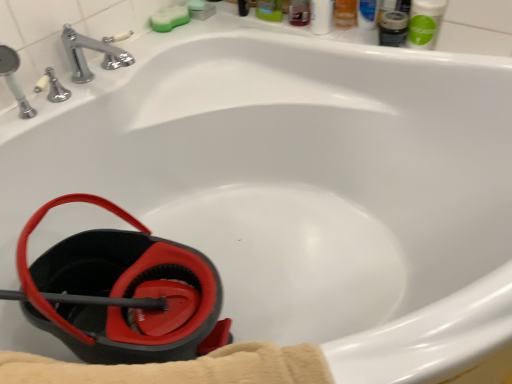
What are the coordinates of `green sponge at upper center` in the screenshot? It's located at (169, 18).

At what (x,y) coordinates should I click in order to perform the action: click on matte black mouthwash at upper right, which appears as the second mouthwash when viewed from the right. Please return your answer as a coordinate pair (x, y). The width and height of the screenshot is (512, 384). Looking at the image, I should click on (393, 28).

Locate an element on the screen. green sponge at upper center is located at coordinates (169, 18).

Are green sponge at upper center and matte black mouthwash at upper right, which appears as the second mouthwash when viewed from the right, located far from each other?

They are positioned close to each other.

Could you tell me if green sponge at upper center is facing matte black mouthwash at upper right, which appears as the second mouthwash when viewed from the right?

Yes, green sponge at upper center is turned towards matte black mouthwash at upper right, which appears as the second mouthwash when viewed from the right.

Does green sponge at upper center have a smaller size compared to matte black mouthwash at upper right, which appears as the second mouthwash when viewed from the right?

Yes, green sponge at upper center is smaller than matte black mouthwash at upper right, which appears as the second mouthwash when viewed from the right.

Consider the image. Considering the relative positions of green sponge at upper center and matte black mouthwash at upper right, which appears as the second mouthwash when viewed from the right, in the image provided, is green sponge at upper center to the right of matte black mouthwash at upper right, which appears as the second mouthwash when viewed from the right, from the viewer's perspective?

Incorrect, green sponge at upper center is not on the right side of matte black mouthwash at upper right, which appears as the second mouthwash when viewed from the right.

Where is `the 2nd mouthwash above the black rubber bucket at lower left (from the image's perspective)`? This screenshot has width=512, height=384. the 2nd mouthwash above the black rubber bucket at lower left (from the image's perspective) is located at coordinates pyautogui.click(x=425, y=23).

In terms of width, does green matte mouthwash at upper right, the first mouthwash positioned from the right, look wider or thinner when compared to black rubber bucket at lower left?

In the image, green matte mouthwash at upper right, the first mouthwash positioned from the right, appears to be more narrow than black rubber bucket at lower left.

Could you measure the distance between green matte mouthwash at upper right, the first mouthwash positioned from the right, and black rubber bucket at lower left?

1.10 meters.

Can you confirm if green matte mouthwash at upper right, the first mouthwash positioned from the right, is shorter than black rubber bucket at lower left?

Correct, green matte mouthwash at upper right, the first mouthwash positioned from the right, is not as tall as black rubber bucket at lower left.

Does green sponge at upper center have a lesser height compared to black rubber bucket at lower left?

Yes.

Does point (170, 11) appear closer or farther from the camera than point (177, 349)?

Clearly, point (170, 11) is more distant from the camera than point (177, 349).

Is green sponge at upper center smaller than black rubber bucket at lower left?

Yes, green sponge at upper center is smaller than black rubber bucket at lower left.

Locate an element on the screen. job in front of the green sponge at upper center is located at coordinates (122, 293).

Which is behind, matte black mouthwash at upper right, which appears as the second mouthwash when viewed from the right, or black rubber bucket at lower left?

matte black mouthwash at upper right, which appears as the second mouthwash when viewed from the right, is more distant.

Which object is positioned more to the left, matte black mouthwash at upper right, which appears as the second mouthwash when viewed from the right, or black rubber bucket at lower left?

black rubber bucket at lower left.

From the image's perspective, between matte black mouthwash at upper right, which appears as the second mouthwash when viewed from the right, and black rubber bucket at lower left, who is located below?

black rubber bucket at lower left appears lower in the image.

Is matte black mouthwash at upper right, which appears as the second mouthwash when viewed from the right, facing towards black rubber bucket at lower left?

Yes, matte black mouthwash at upper right, which appears as the second mouthwash when viewed from the right, faces towards black rubber bucket at lower left.

Considering the sizes of objects green matte mouthwash at upper right, which is the 2th mouthwash in left-to-right order, and matte black mouthwash at upper right, which appears as the first mouthwash when viewed from the left, in the image provided, who is thinner, green matte mouthwash at upper right, which is the 2th mouthwash in left-to-right order, or matte black mouthwash at upper right, which appears as the first mouthwash when viewed from the left,?

With smaller width is matte black mouthwash at upper right, which appears as the first mouthwash when viewed from the left.

From a real-world perspective, who is located lower, green matte mouthwash at upper right, the first mouthwash positioned from the right, or matte black mouthwash at upper right, which appears as the second mouthwash when viewed from the right?

matte black mouthwash at upper right, which appears as the second mouthwash when viewed from the right.

Is green matte mouthwash at upper right, which is the 2th mouthwash in left-to-right order, oriented away from matte black mouthwash at upper right, which appears as the first mouthwash when viewed from the left?

green matte mouthwash at upper right, which is the 2th mouthwash in left-to-right order, is not turned away from matte black mouthwash at upper right, which appears as the first mouthwash when viewed from the left.

Is green matte mouthwash at upper right, the first mouthwash positioned from the right, next to matte black mouthwash at upper right, which appears as the first mouthwash when viewed from the left?

Yes, green matte mouthwash at upper right, the first mouthwash positioned from the right, is right next to matte black mouthwash at upper right, which appears as the first mouthwash when viewed from the left, and making contact.

Is green sponge at upper center inside black rubber bucket at lower left?

No, green sponge at upper center is not a part of black rubber bucket at lower left.

Between point (218, 325) and point (186, 12), which one is positioned in front?

The point (218, 325) is closer to the camera.

Which object is further away from the camera, black rubber bucket at lower left or green sponge at upper center?

green sponge at upper center.

How different are the orientations of green sponge at upper center and green matte mouthwash at upper right, which is the 2th mouthwash in left-to-right order, in degrees?

The angle between the facing direction of green sponge at upper center and the facing direction of green matte mouthwash at upper right, which is the 2th mouthwash in left-to-right order, is 87.6 degrees.

Is green sponge at upper center to the left or to the right of green matte mouthwash at upper right, the first mouthwash positioned from the right, in the image?

In the image, green sponge at upper center appears on the left side of green matte mouthwash at upper right, the first mouthwash positioned from the right.

In the image, is green sponge at upper center positioned in front of or behind green matte mouthwash at upper right, which is the 2th mouthwash in left-to-right order?

Visually, green sponge at upper center is located behind green matte mouthwash at upper right, which is the 2th mouthwash in left-to-right order.

At what (x,y) coordinates should I click in order to perform the action: click on soap that is above the green matte mouthwash at upper right, which is the 2th mouthwash in left-to-right order (from the image's perspective). Please return your answer as a coordinate pair (x, y). This screenshot has width=512, height=384. Looking at the image, I should click on (169, 18).

Identify the location of soap on the left of matte black mouthwash at upper right, which appears as the first mouthwash when viewed from the left. The height and width of the screenshot is (384, 512). (169, 18).

Image resolution: width=512 pixels, height=384 pixels. In order to click on the 2nd mouthwash to the right when counting from the black rubber bucket at lower left in this screenshot , I will do `click(425, 23)`.

Based on their spatial positions, is green matte mouthwash at upper right, which is the 2th mouthwash in left-to-right order, or green sponge at upper center further from matte black mouthwash at upper right, which appears as the first mouthwash when viewed from the left?

green sponge at upper center.

Considering their positions, is black rubber bucket at lower left positioned further to matte black mouthwash at upper right, which appears as the first mouthwash when viewed from the left, than green matte mouthwash at upper right, which is the 2th mouthwash in left-to-right order?

The object further to matte black mouthwash at upper right, which appears as the first mouthwash when viewed from the left, is black rubber bucket at lower left.

Looking at the image, which one is located closer to green matte mouthwash at upper right, the first mouthwash positioned from the right, matte black mouthwash at upper right, which appears as the first mouthwash when viewed from the left, or black rubber bucket at lower left?

matte black mouthwash at upper right, which appears as the first mouthwash when viewed from the left, is positioned closer to the anchor green matte mouthwash at upper right, the first mouthwash positioned from the right.

Looking at the image, which one is located closer to matte black mouthwash at upper right, which appears as the second mouthwash when viewed from the right, green sponge at upper center or black rubber bucket at lower left?

green sponge at upper center is positioned closer to the anchor matte black mouthwash at upper right, which appears as the second mouthwash when viewed from the right.

Based on their spatial positions, is green sponge at upper center or green matte mouthwash at upper right, the first mouthwash positioned from the right, closer to matte black mouthwash at upper right, which appears as the first mouthwash when viewed from the left?

Based on the image, green matte mouthwash at upper right, the first mouthwash positioned from the right, appears to be nearer to matte black mouthwash at upper right, which appears as the first mouthwash when viewed from the left.

Considering their positions, is green matte mouthwash at upper right, the first mouthwash positioned from the right, positioned closer to green sponge at upper center than matte black mouthwash at upper right, which appears as the second mouthwash when viewed from the right?

matte black mouthwash at upper right, which appears as the second mouthwash when viewed from the right.

Looking at the image, which one is located closer to green matte mouthwash at upper right, which is the 2th mouthwash in left-to-right order, green sponge at upper center or black rubber bucket at lower left?

The object closer to green matte mouthwash at upper right, which is the 2th mouthwash in left-to-right order, is green sponge at upper center.

From the image, which object appears to be farther from green sponge at upper center, green matte mouthwash at upper right, which is the 2th mouthwash in left-to-right order, or black rubber bucket at lower left?

black rubber bucket at lower left is positioned further to the anchor green sponge at upper center.

This screenshot has height=384, width=512. I want to click on mouthwash situated between green sponge at upper center and green matte mouthwash at upper right, which is the 2th mouthwash in left-to-right order, from left to right, so click(393, 28).

In order to click on soap located between black rubber bucket at lower left and green matte mouthwash at upper right, the first mouthwash positioned from the right, in the left-right direction in this screenshot , I will do `click(169, 18)`.

At what (x,y) coordinates should I click in order to perform the action: click on mouthwash between black rubber bucket at lower left and green matte mouthwash at upper right, the first mouthwash positioned from the right, in the horizontal direction. Please return your answer as a coordinate pair (x, y). This screenshot has height=384, width=512. Looking at the image, I should click on (393, 28).